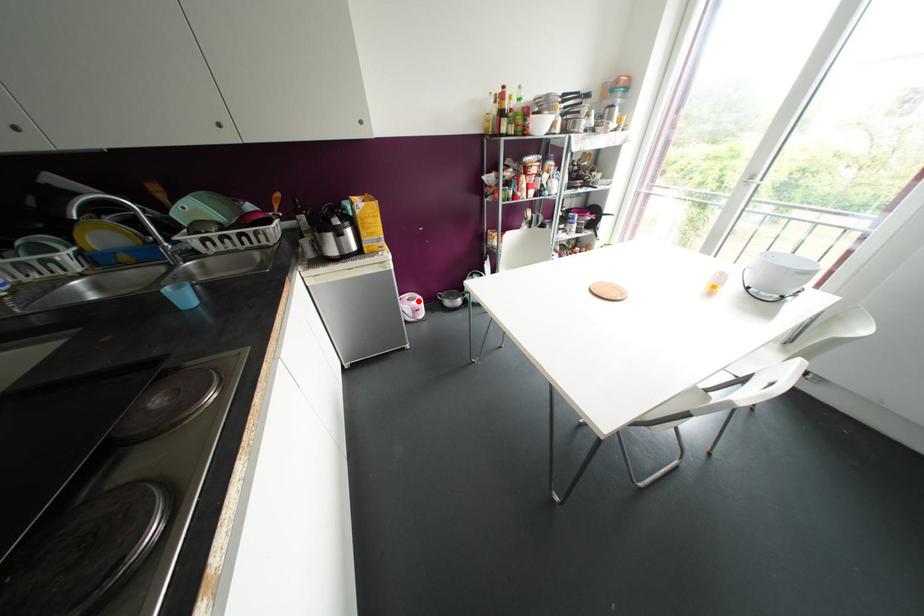
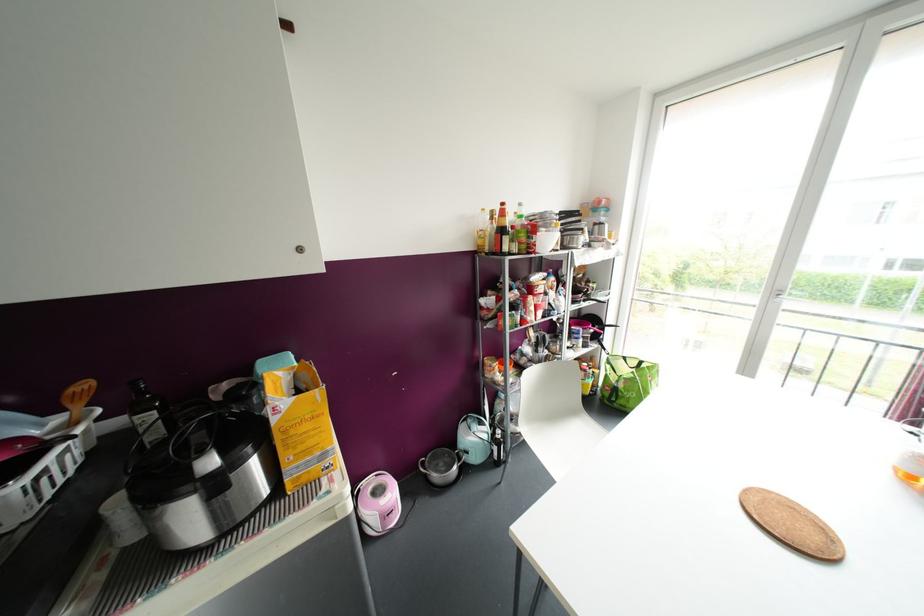
In the second image, find the point that corresponds to the highlighted location in the first image.

(392, 493)